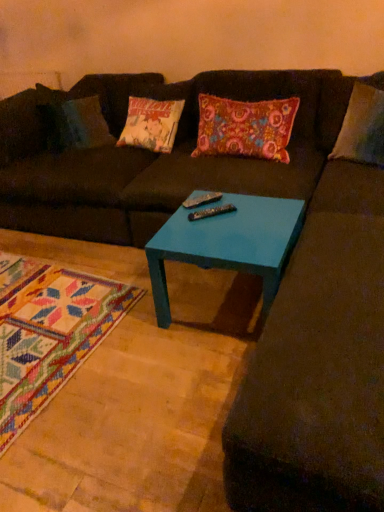
Question: Is teal glossy table at center behind matte brown futon at center?

Choices:
 (A) yes
 (B) no

Answer: (B)

Question: Can you confirm if teal glossy table at center is positioned to the left of matte brown futon at center?

Choices:
 (A) yes
 (B) no

Answer: (B)

Question: Does teal glossy table at center appear on the right side of matte brown futon at center?

Choices:
 (A) no
 (B) yes

Answer: (B)

Question: Could you tell me if teal glossy table at center is facing matte brown futon at center?

Choices:
 (A) no
 (B) yes

Answer: (A)

Question: From a real-world perspective, is teal glossy table at center beneath matte brown futon at center?

Choices:
 (A) yes
 (B) no

Answer: (A)

Question: From the image's perspective, is floral fabric pillow at center positioned above or below metallic silver remote at center, the first remote positioned from the back?

Choices:
 (A) below
 (B) above

Answer: (B)

Question: Considering the positions of floral fabric pillow at center and metallic silver remote at center, the first remote positioned from the back, in the image, is floral fabric pillow at center wider or thinner than metallic silver remote at center, the first remote positioned from the back,?

Choices:
 (A) wide
 (B) thin

Answer: (A)

Question: Would you say floral fabric pillow at center is to the left or to the right of metallic silver remote at center, the first remote positioned from the back, in the picture?

Choices:
 (A) left
 (B) right

Answer: (B)

Question: Considering the positions of floral fabric pillow at center and metallic silver remote at center, the first remote positioned from the back, in the image, is floral fabric pillow at center bigger or smaller than metallic silver remote at center, the first remote positioned from the back,?

Choices:
 (A) big
 (B) small

Answer: (A)

Question: From a real-world perspective, is matte brown futon at center above or below floral fabric pillow at center?

Choices:
 (A) below
 (B) above

Answer: (A)

Question: Is matte brown futon at center in front of or behind floral fabric pillow at center in the image?

Choices:
 (A) behind
 (B) front

Answer: (B)

Question: Is matte brown futon at center spatially inside floral fabric pillow at center, or outside of it?

Choices:
 (A) inside
 (B) outside

Answer: (B)

Question: From their relative heights in the image, would you say matte brown futon at center is taller or shorter than floral fabric pillow at center?

Choices:
 (A) tall
 (B) short

Answer: (A)

Question: From the image's perspective, is floral fabric pillow at center positioned above or below matte brown futon at center?

Choices:
 (A) above
 (B) below

Answer: (A)

Question: Considering the positions of point pos(276,140) and point pos(190,112), is point pos(276,140) closer or farther from the camera than point pos(190,112)?

Choices:
 (A) closer
 (B) farther

Answer: (A)